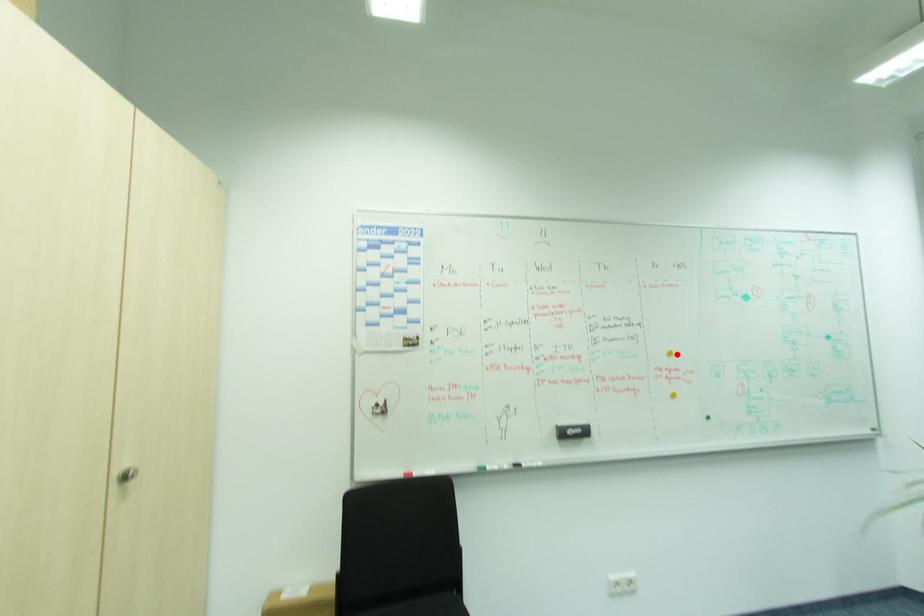
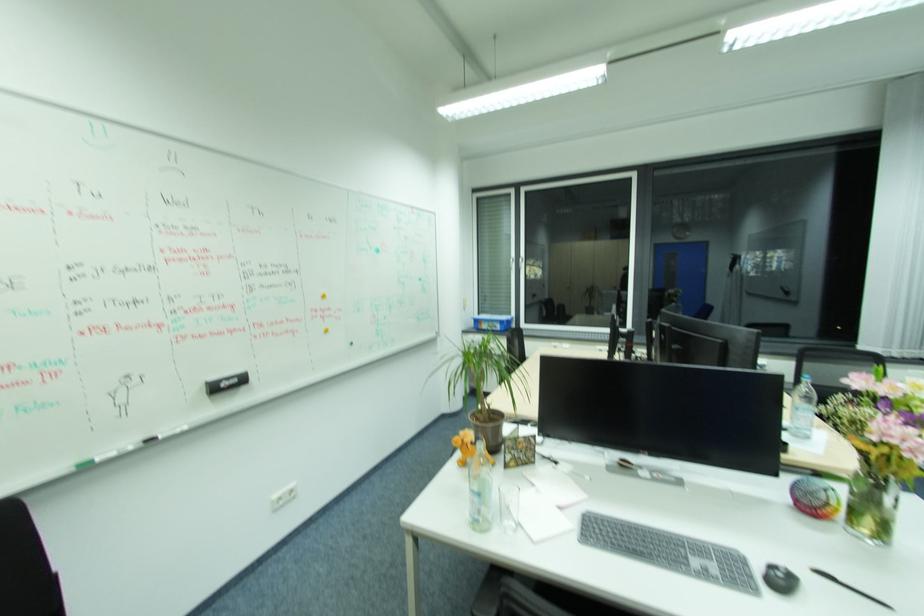
In the second image, find the point that corresponds to the highlighted location in the first image.

(329, 296)